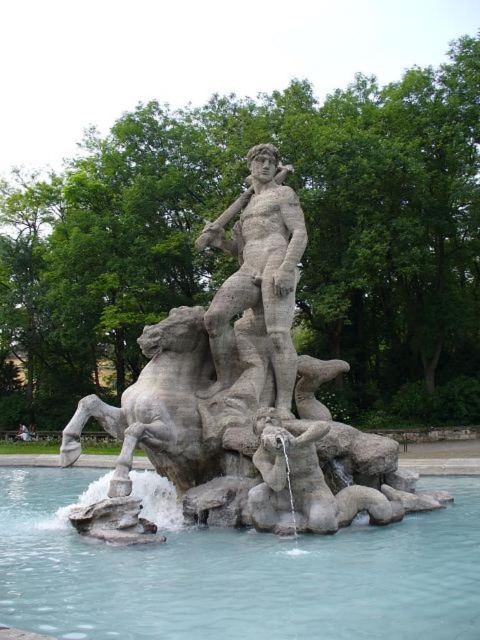
Between stone statue at center and clear blue water at center, which one is positioned higher?

stone statue at center

Which is in front, point (202, 516) or point (288, 540)?

Positioned in front is point (288, 540).

Is point (219, 406) positioned after point (287, 598)?

Yes, point (219, 406) is behind point (287, 598).

Image resolution: width=480 pixels, height=640 pixels. I want to click on stone statue at center, so click(x=241, y=400).

Who is positioned more to the left, stone statue at center or gray stone statue at center?

Positioned to the left is gray stone statue at center.

Who is more forward, (176, 323) or (243, 381)?

Point (176, 323) is in front.

Does point (255, 422) come farther from viewer compared to point (254, 282)?

No, it is in front of (254, 282).

Find the location of a particular element. The height and width of the screenshot is (640, 480). stone statue at center is located at coordinates (241, 400).

Is clear blue water at center positioned in front of gray stone statue at center?

That is True.

Which is more to the right, clear blue water at center or gray stone statue at center?

gray stone statue at center

The height and width of the screenshot is (640, 480). What are the coordinates of `clear blue water at center` in the screenshot? It's located at (232, 570).